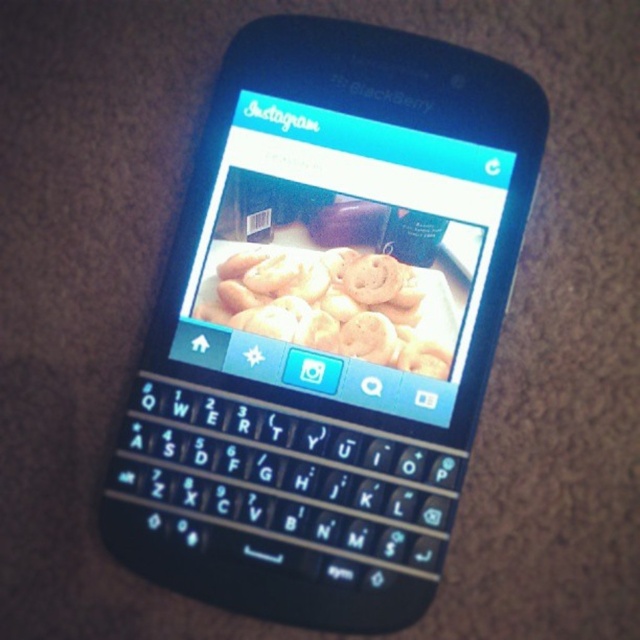
You are trying to place both the black plastic smartphone at center and the golden matte cookies at center into a rectangular box that can only fit items up to 15 cm in width. Given their sizes, can both items fit side by side within the box?

The black plastic smartphone at center is wider than the golden matte cookies at center. Since the box can only accommodate items up to 15 cm in width, and the smartphone is wider than the cookies, both items might not fit side by side unless the smartphone is under 15 cm. However, without exact measurements, we can only confirm that the smartphone is wider than the cookies, but cannot determine if their combined width exceeds the box limit.

You are taking a photo of the BlackBerry smartphone and the Instagram post of bread rolls. You want to ensure that both points, point (426,348) and point (326,253), are in focus. Which point should you focus on first to ensure the other is also in focus?

You should focus on point (326,253) first because it is farther from the camera than point (426,348). By focusing on the farther point, the closer point will also be within the depth of field, ensuring both are in focus.